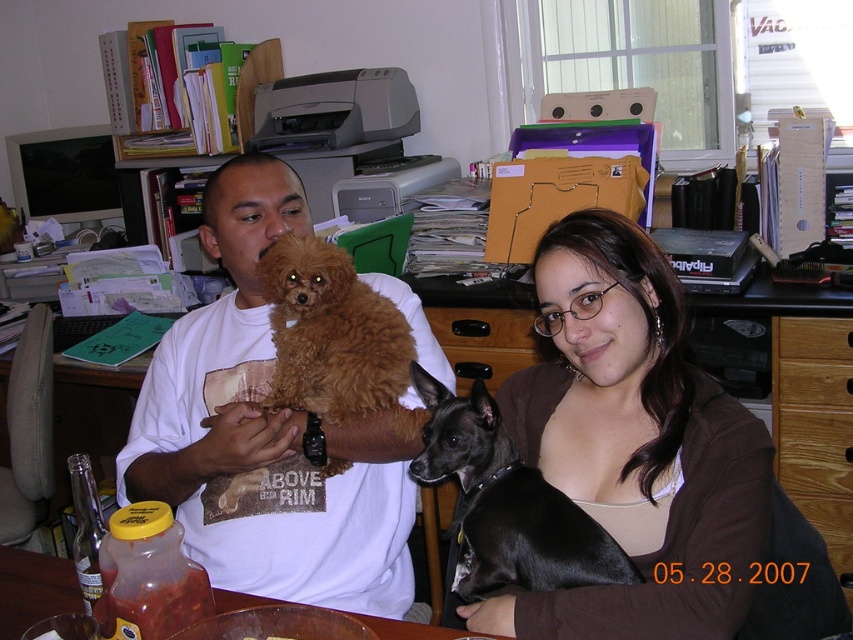
Question: Which of the following is the farthest from the observer?

Choices:
 (A) (239, 595)
 (B) (473, 330)
 (C) (564, 620)

Answer: (B)

Question: Which of the following is the closest to the observer?

Choices:
 (A) (485, 314)
 (B) (74, 584)
 (C) (842, 342)

Answer: (B)

Question: Does white t-shirt at center have a greater width compared to black smooth dog at center?

Choices:
 (A) no
 (B) yes

Answer: (B)

Question: From the image, what is the correct spatial relationship of transparent plastic bottle at lower left in relation to wooden drawer at center?

Choices:
 (A) above
 (B) below

Answer: (B)

Question: Which of the following is the closest to the observer?

Choices:
 (A) fuzzy brown dog at center
 (B) black smooth dog at center
 (C) matte brown hair at upper center

Answer: (C)

Question: Does oak wood drawer at center appear on the right side of transparent plastic bottle at lower left?

Choices:
 (A) yes
 (B) no

Answer: (A)